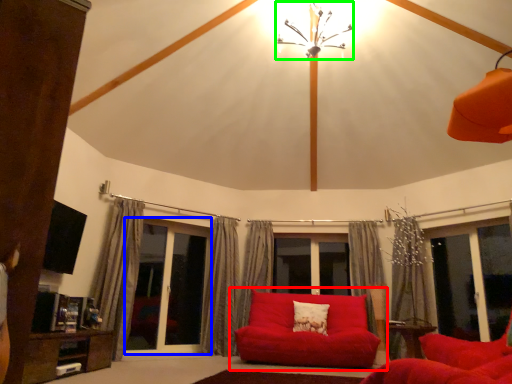
Question: Which object is positioned closest to studio couch (highlighted by a red box)? Select from screen door (highlighted by a blue box) and light fixture (highlighted by a green box).

Choices:
 (A) screen door
 (B) light fixture

Answer: (A)